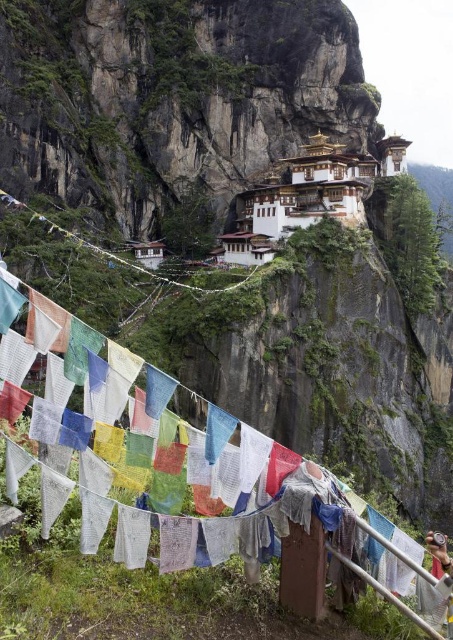
Does colorful fabric clothesline at lower center have a larger size compared to white painted stone building at upper center?

Incorrect, colorful fabric clothesline at lower center is not larger than white painted stone building at upper center.

Is colorful fabric clothesline at lower center above white painted stone building at upper center?

No, colorful fabric clothesline at lower center is not above white painted stone building at upper center.

Who is more distant from viewer, (x=308, y=602) or (x=245, y=205)?

Positioned behind is point (x=245, y=205).

You are a GUI agent. You are given a task and a screenshot of the screen. Output one action in this format:
    pyautogui.click(x=<x>, y=<y>)
    Task: Click on the colorful fabric clothesline at lower center
    The image size is (453, 640).
    Given the screenshot: What is the action you would take?
    pyautogui.click(x=212, y=499)